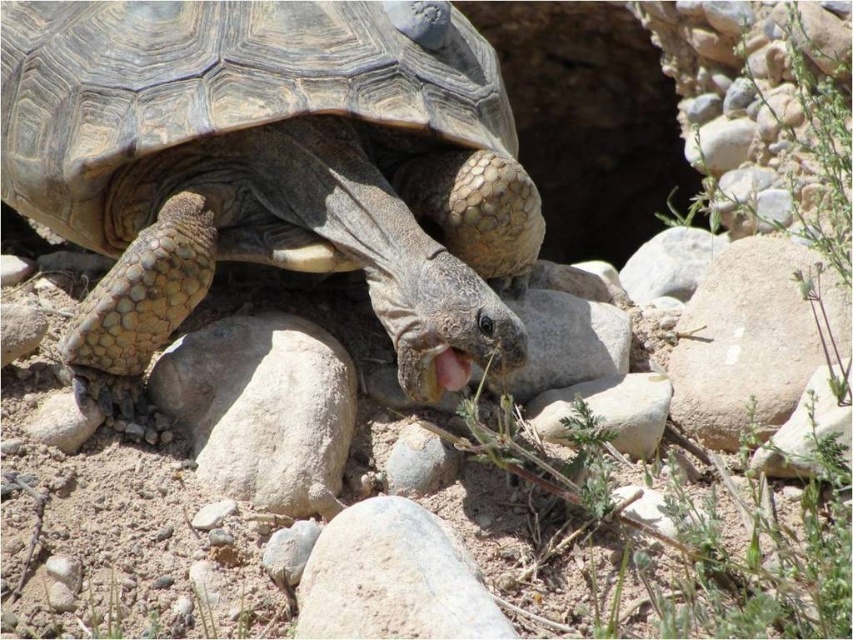
Question: Among these objects, which one is farthest from the camera?

Choices:
 (A) smooth gray rock at center
 (B) smooth beige rock at center-right

Answer: (B)

Question: Which point is farther from the camera taking this photo?

Choices:
 (A) (281, 435)
 (B) (614, 244)

Answer: (B)

Question: Which object appears farthest from the camera in this image?

Choices:
 (A) smooth beige rock at center-right
 (B) leathery brown tortoise at center
 (C) gray rough rock at center

Answer: (A)

Question: Where is gray rough rock at center located in relation to smooth gray rock at center in the image?

Choices:
 (A) left
 (B) right

Answer: (A)

Question: Can you confirm if gray rough rock at lower center is wider than pink matte tongue at center?

Choices:
 (A) no
 (B) yes

Answer: (B)

Question: Does rocky cave at upper center appear over gray rough rock at center?

Choices:
 (A) yes
 (B) no

Answer: (A)